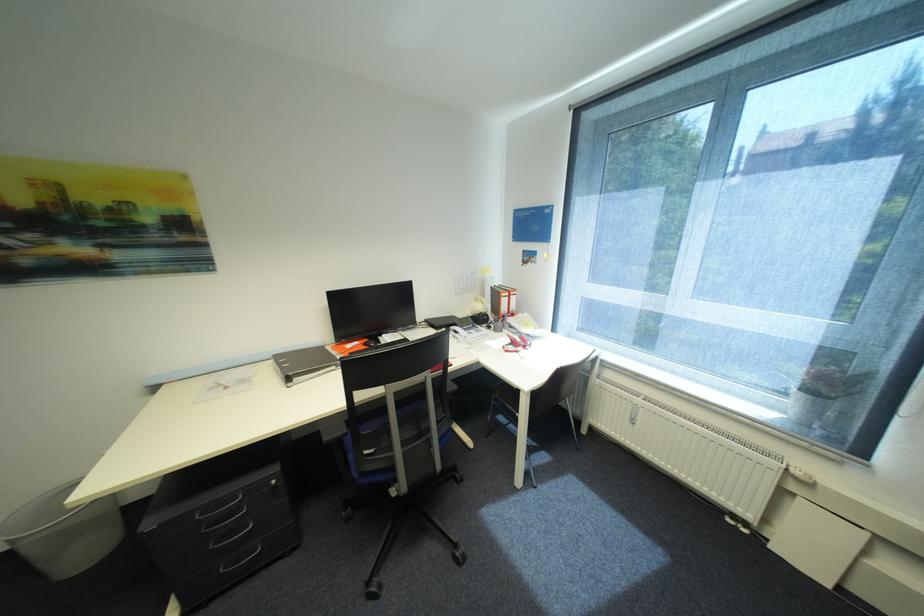
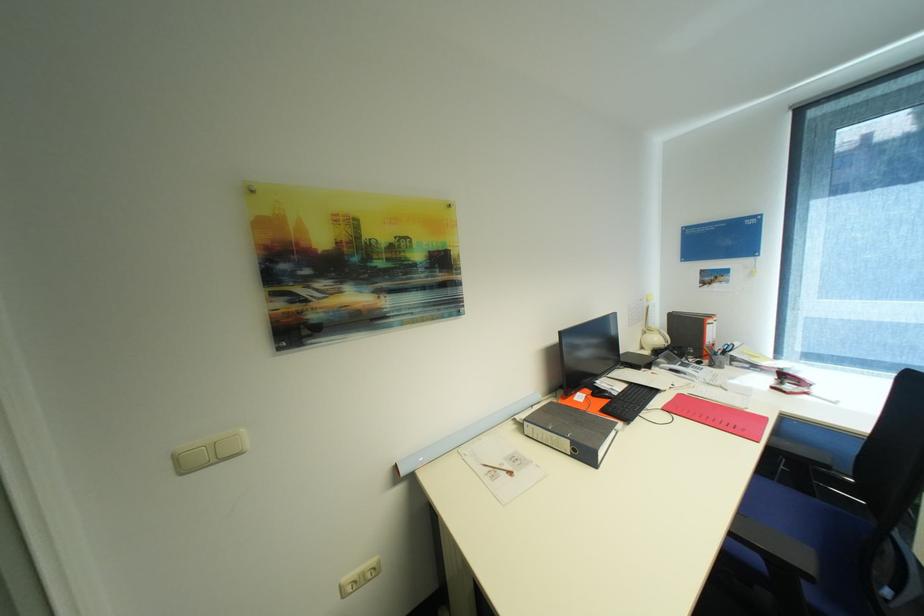
Where in the second image is the point corresponding to the point at 488,307 from the first image?

(663, 339)